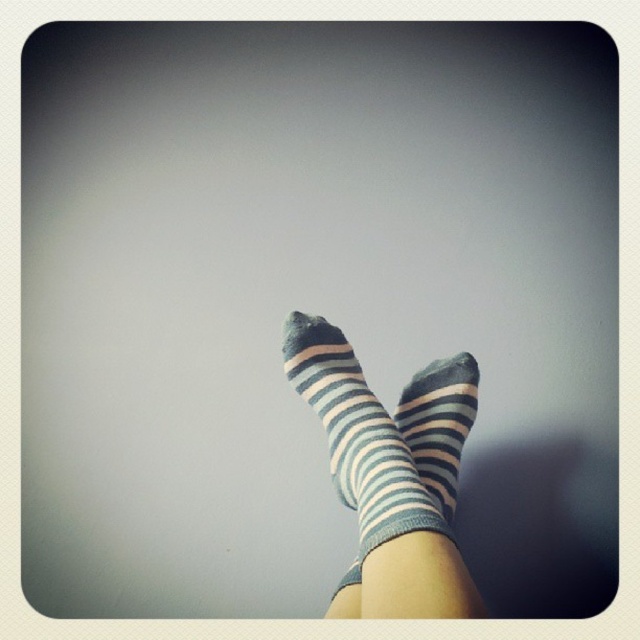
Does blue striped socks at center have a smaller size compared to striped cotton socks at center?

No.

Can you confirm if blue striped socks at center is positioned to the left of striped cotton socks at center?

Yes, blue striped socks at center is to the left of striped cotton socks at center.

Which is in front, point (413, 524) or point (452, 397)?

Point (413, 524) is in front.

Where is `blue striped socks at center`? This screenshot has width=640, height=640. blue striped socks at center is located at coordinates (380, 436).